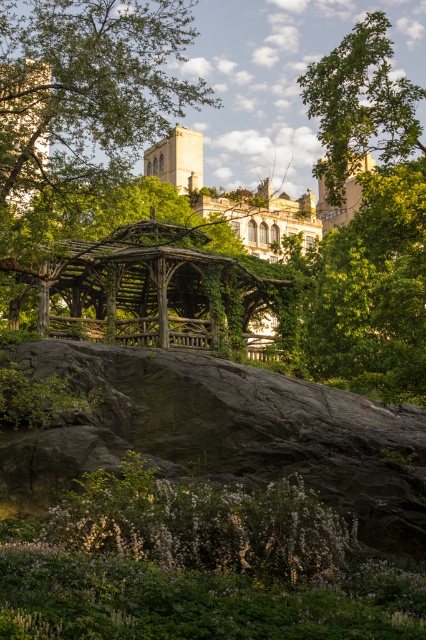
You are planning to set up a picnic blanket in the park. You see the dark gray rock at center and the green leafy tree at upper right. Which object is located closer to the tree?

The dark gray rock at center is positioned under green leafy tree at upper right, so it is closer to the tree than the tree itself.

You are standing in the park and want to take a photo of the dark gray rock at center and the green leafy tree at upper right. Which object should you focus on first if you want to capture both in a single frame without moving the camera?

The dark gray rock at center has a lesser height compared to the green leafy tree at upper right, so you should focus on the dark gray rock at center first to ensure both are in the frame.

You are planning to place a small garden statue that is 1 meter wide in the park. Given the dark gray rock at center and the green leafy tree at upper right, which object has enough space to accommodate the statue without overlapping?

The green leafy tree at upper right has a width greater than the dark gray rock at center, so the statue can be placed near the green leafy tree at upper right as it provides sufficient space.